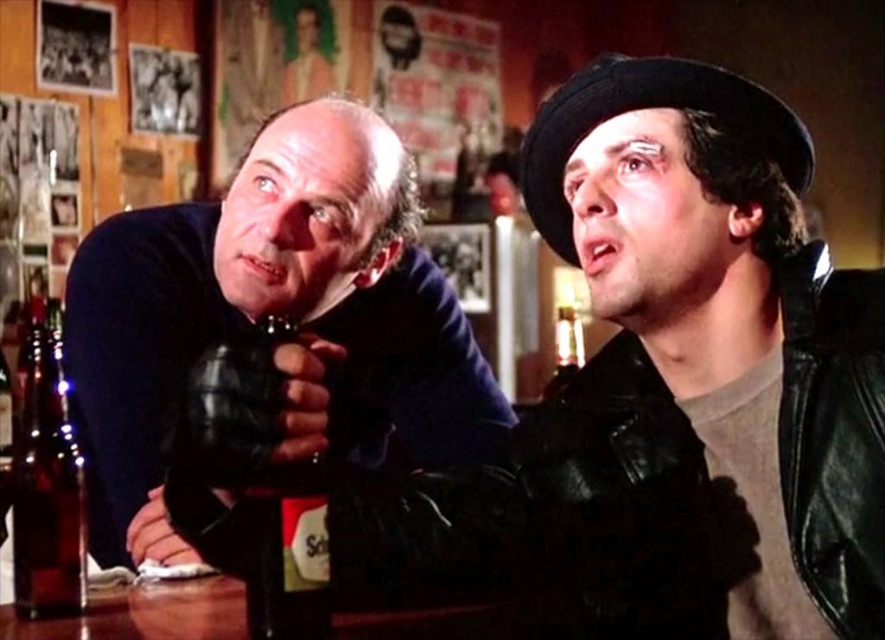
In the scene, there are a dark blue sweater at left and a translucent glass bottle at center. Which object is taller?

The dark blue sweater at left is taller than the translucent glass bottle at center.